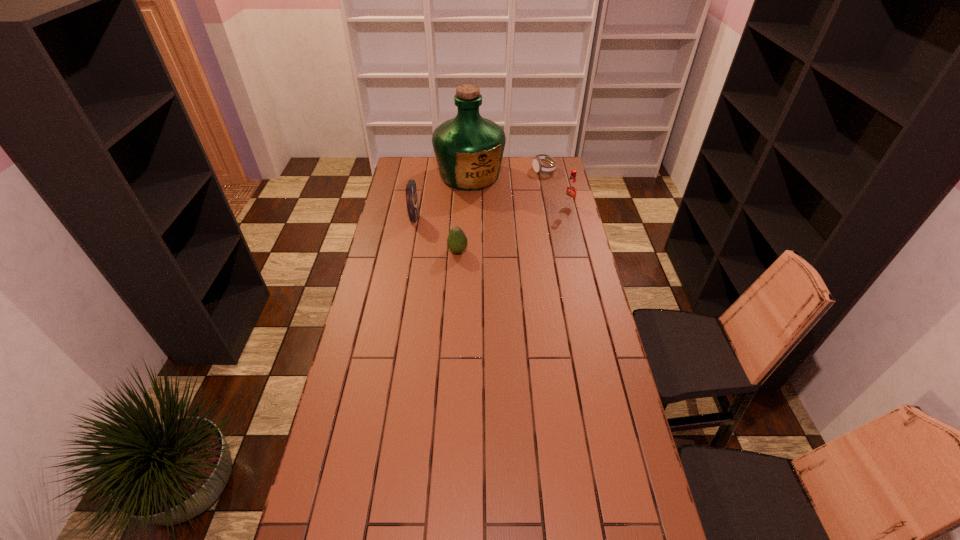
Image resolution: width=960 pixels, height=540 pixels. What are the coordinates of `blank area located 0.380m on the front face of the cellular telephone` in the screenshot? It's located at (499, 225).

The width and height of the screenshot is (960, 540). What are the coordinates of `vacant space situated 0.100m on the front face of the cellular telephone` in the screenshot? It's located at (440, 221).

You are a GUI agent. You are given a task and a screenshot of the screen. Output one action in this format:
    pyautogui.click(x=<x>, y=<y>)
    Task: Click on the vacant area situated 0.140m on the face of the watch
    
    Given the screenshot: What is the action you would take?
    pyautogui.click(x=539, y=191)

The width and height of the screenshot is (960, 540). Find the location of `vacant space located on the face of the watch`. vacant space located on the face of the watch is located at coordinates (537, 199).

Find the location of a particular element. Image resolution: width=960 pixels, height=540 pixels. vacant space located 0.320m on the face of the watch is located at coordinates (535, 211).

Where is `free space located on the label side of the tallest object`? free space located on the label side of the tallest object is located at coordinates (500, 232).

The image size is (960, 540). I want to click on free space located 0.400m on the label side of the tallest object, so click(507, 242).

This screenshot has width=960, height=540. In order to click on free space located on the label side of the tallest object in this screenshot , I will do `click(504, 239)`.

This screenshot has width=960, height=540. I want to click on watch that is at the far edge, so click(538, 166).

Where is `liquor positioned at the far edge`? liquor positioned at the far edge is located at coordinates (468, 148).